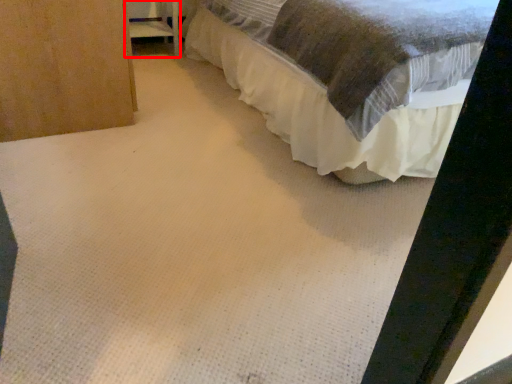
Question: From the image's perspective, what is the correct spatial relationship of furniture (annotated by the red box) in relation to bed?

Choices:
 (A) above
 (B) below

Answer: (A)